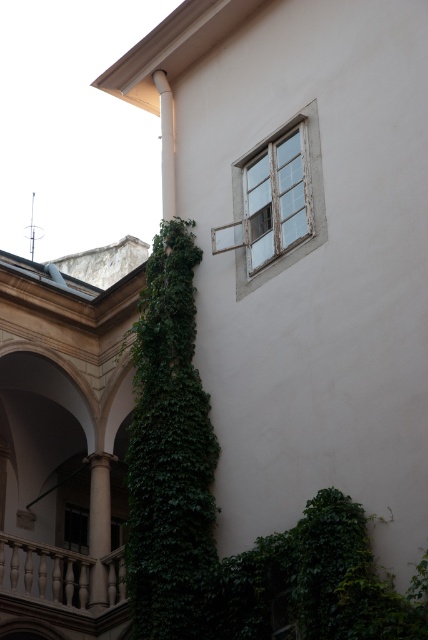
In the scene shown: You are an architect designing a garden and want to know which ivy has a smaller width for placement purposes. Which one between the green leafy ivy at left and the green leafy ivy at lower right has a smaller width?

The green leafy ivy at left has a smaller width compared to the green leafy ivy at lower right.

You are an artist sketching the building exterior. You notice two areas of green leafy ivy in the scene. Which ivy is closer to you, the green leafy ivy at left or the green leafy ivy at lower right?

The green leafy ivy at left is closer to you because the green leafy ivy at lower right is behind it.

You are standing in front of the building exterior described. There is a green leafy ivy at lower right. Can you estimate its position relative to the wall?

The green leafy ivy at lower right is located at point coordinates approximately 0.911 on the x axis and 0.738 on the y axis.